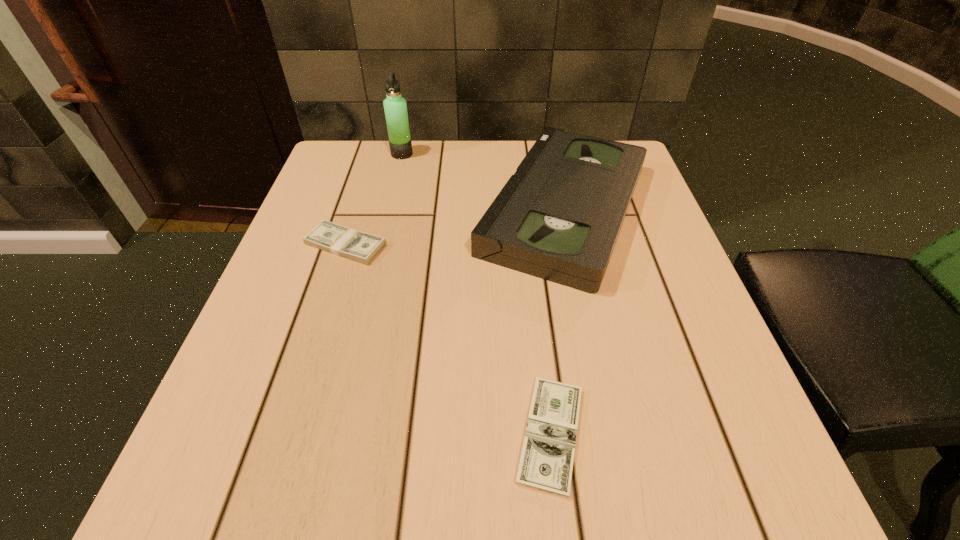
This screenshot has width=960, height=540. I want to click on the tallest object, so click(395, 107).

The width and height of the screenshot is (960, 540). In order to click on the third shortest object in this screenshot , I will do `click(558, 218)`.

Where is `the farther dollar`? This screenshot has height=540, width=960. the farther dollar is located at coordinates (361, 247).

Identify the location of the taller dollar. (361, 247).

Where is `the shortest object`? the shortest object is located at coordinates (546, 463).

This screenshot has height=540, width=960. Identify the location of the right dollar. (546, 463).

The height and width of the screenshot is (540, 960). I want to click on free space located on the front of the thermos bottle, so click(393, 193).

Locate an element on the screen. The width and height of the screenshot is (960, 540). free space located on the front of the second tallest object is located at coordinates (591, 330).

This screenshot has height=540, width=960. I want to click on vacant region located on the right of the third tallest object, so [545, 245].

This screenshot has height=540, width=960. I want to click on free location located on the left of the right dollar, so click(x=247, y=434).